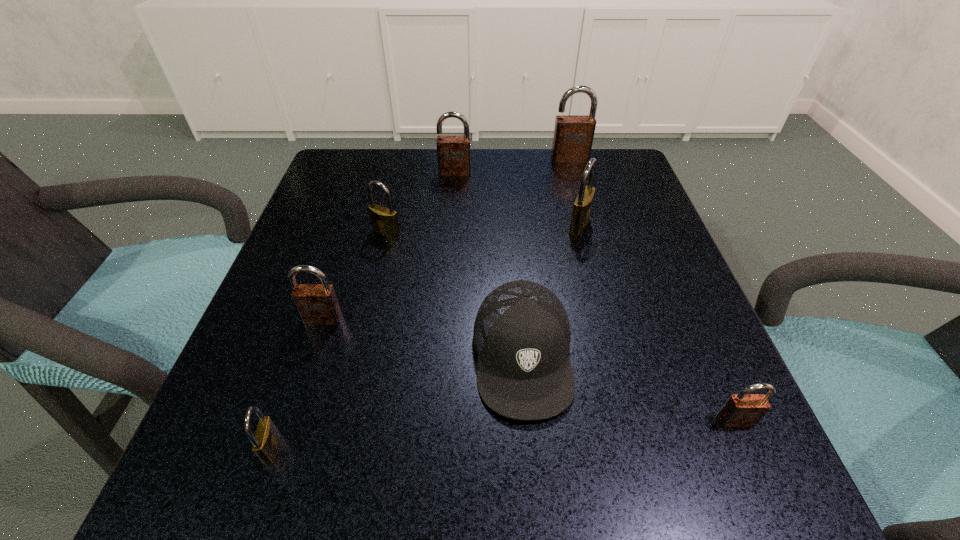
The width and height of the screenshot is (960, 540). Identify the location of free spot at the near left corner of the desktop. (202, 446).

In the image, there is a desktop. Identify the location of vacant region at the far right corner. Image resolution: width=960 pixels, height=540 pixels. (604, 188).

This screenshot has height=540, width=960. What are the coordinates of `vacant area that lies between the second smallest brown padlock and the third brown padlock from left to right` in the screenshot? It's located at (446, 239).

Identify the location of free area in between the nearest padlock and the fourth object from left to right. This screenshot has height=540, width=960. (364, 310).

Find the location of a particular element. vacant space that's between the third smallest brown padlock and the biggest brown padlock is located at coordinates (513, 166).

Where is `unoccupied position between the fifth object from left to right and the third brown padlock from left to right`? The height and width of the screenshot is (540, 960). unoccupied position between the fifth object from left to right and the third brown padlock from left to right is located at coordinates (546, 257).

The width and height of the screenshot is (960, 540). Find the location of `blank region between the third biggest brown padlock and the third brown padlock from left to right`. blank region between the third biggest brown padlock and the third brown padlock from left to right is located at coordinates (446, 239).

Locate an element on the screen. This screenshot has width=960, height=540. free space that is in between the leftmost brass padlock and the farthest padlock is located at coordinates (421, 303).

This screenshot has height=540, width=960. Find the location of `blank region between the fifth farthest padlock and the rightmost brass padlock`. blank region between the fifth farthest padlock and the rightmost brass padlock is located at coordinates (451, 272).

The height and width of the screenshot is (540, 960). I want to click on vacant area that lies between the rightmost object and the leftmost brass padlock, so click(504, 434).